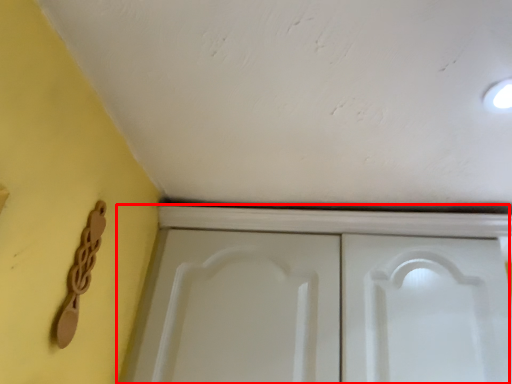
Question: From the image's perspective, where is cupboard (annotated by the red box) located relative to door handle?

Choices:
 (A) above
 (B) below

Answer: (B)